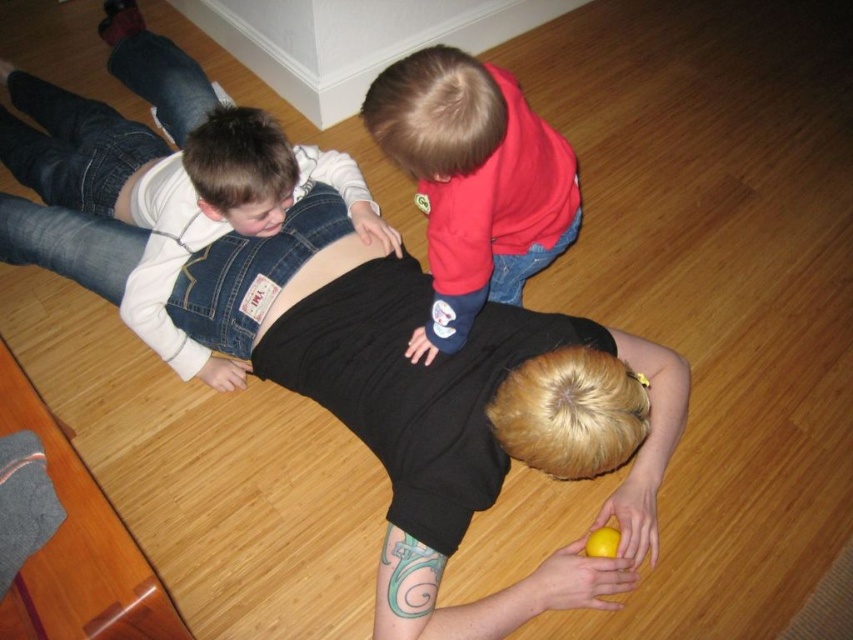
Is denim overalls at upper left bigger than denim at center?

Indeed, denim overalls at upper left has a larger size compared to denim at center.

Does denim overalls at upper left have a lesser height compared to denim at center?

Result: No, denim overalls at upper left is not shorter than denim at center.

Find the location of `denim overalls at upper left`. denim overalls at upper left is located at coordinates coord(170,179).

Is red fleece sweater at upper center to the right of denim at center from the viewer's perspective?

Correct, you'll find red fleece sweater at upper center to the right of denim at center.

Between red fleece sweater at upper center and denim at center, which one has more height?

Standing taller between the two is red fleece sweater at upper center.

What are the coordinates of `red fleece sweater at upper center` in the screenshot? It's located at (473, 180).

At what (x,y) coordinates should I click in order to perform the action: click on red fleece sweater at upper center. Please return your answer as a coordinate pair (x, y). This screenshot has height=640, width=853. Looking at the image, I should click on (473, 180).

Can you confirm if denim overalls at upper left is smaller than red fleece sweater at upper center?

No.

Between denim overalls at upper left and red fleece sweater at upper center, which one appears on the left side from the viewer's perspective?

denim overalls at upper left is more to the left.

Who is more forward, (135, 305) or (576, 225)?

Point (135, 305) is more forward.

The height and width of the screenshot is (640, 853). I want to click on denim overalls at upper left, so click(170, 179).